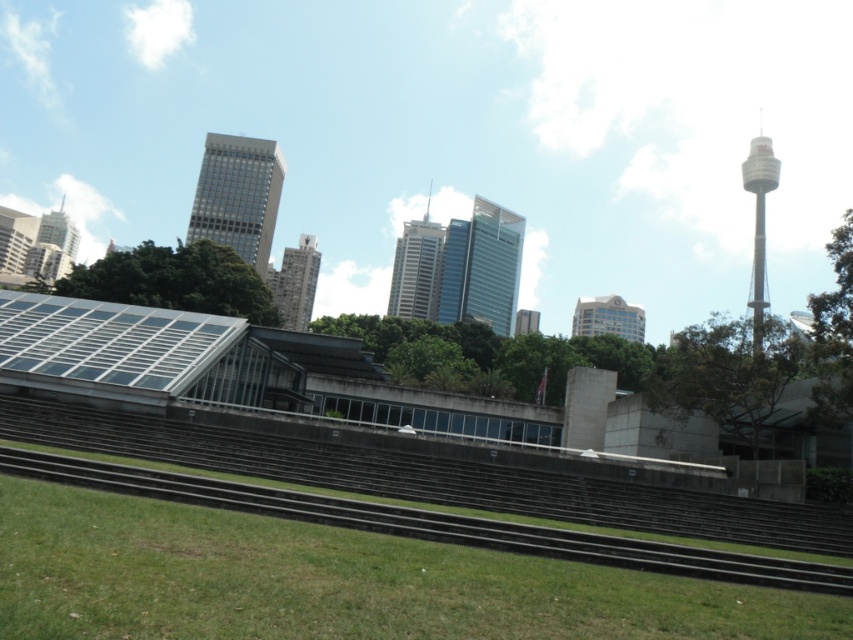
Question: Among these objects, which one is farthest from the camera?

Choices:
 (A) shiny glass skyscraper at center
 (B) matte glass skyscraper at upper left
 (C) glassy reflective skyscraper at upper center
 (D) greenish metallic tower at right

Answer: (A)

Question: Is green grass at lower center further to camera compared to glassy reflective skyscraper at upper center?

Choices:
 (A) no
 (B) yes

Answer: (A)

Question: Does green grass at lower center have a lesser width compared to matte glass skyscraper at upper left?

Choices:
 (A) no
 (B) yes

Answer: (B)

Question: From the image, what is the correct spatial relationship of glassy reflective skyscraper at upper center in relation to smooth glass skyscraper at center?

Choices:
 (A) above
 (B) below

Answer: (A)

Question: Which of the following is the farthest from the observer?

Choices:
 (A) (244, 179)
 (B) (349, 592)
 (C) (421, 317)
 (D) (467, 257)

Answer: (D)

Question: Which of the following is the closest to the observer?

Choices:
 (A) shiny glass skyscraper at center
 (B) glassy reflective skyscraper at upper center
 (C) matte glass skyscraper at upper left

Answer: (C)